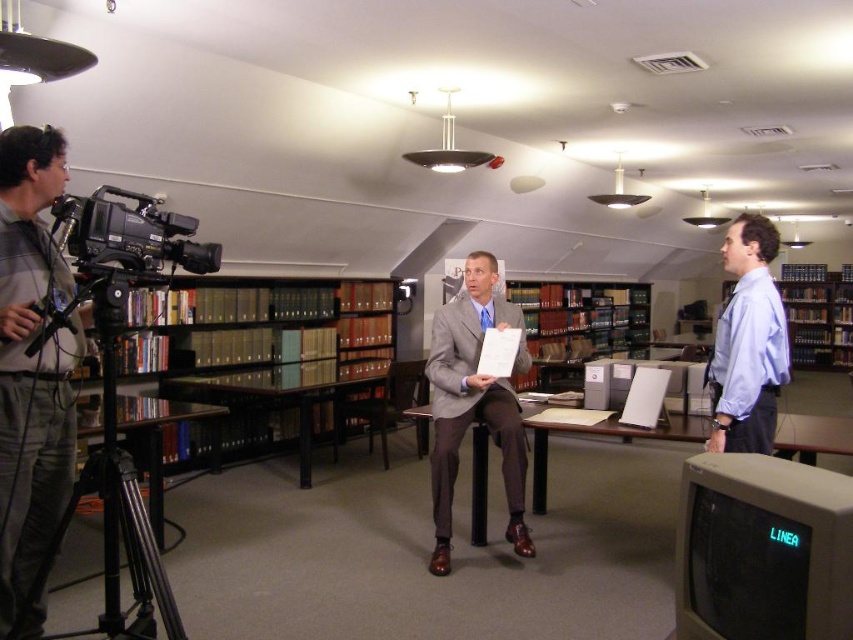
You are a photographer setting up for a shoot in this library scene. You need to ensure that the gray fabric shirt at left is visible in the background behind the brown wooden bookcase at center. Is this possible given their positions?

The brown wooden bookcase at center is positioned over the gray fabric shirt at left, so the gray fabric shirt at left would be obscured and not visible in the background behind the brown wooden bookcase at center.

You are setting up a new desk in the library. The desk you have is the same size as the black glass table at lower left. Will it fit in the space currently occupied by the brown wooden bookshelf at center?

The brown wooden bookshelf at center is bigger than the black glass table at lower left. Since the desk is the same size as the black glass table at lower left, it might be too small to occupy the space intended for the larger bookshelf.